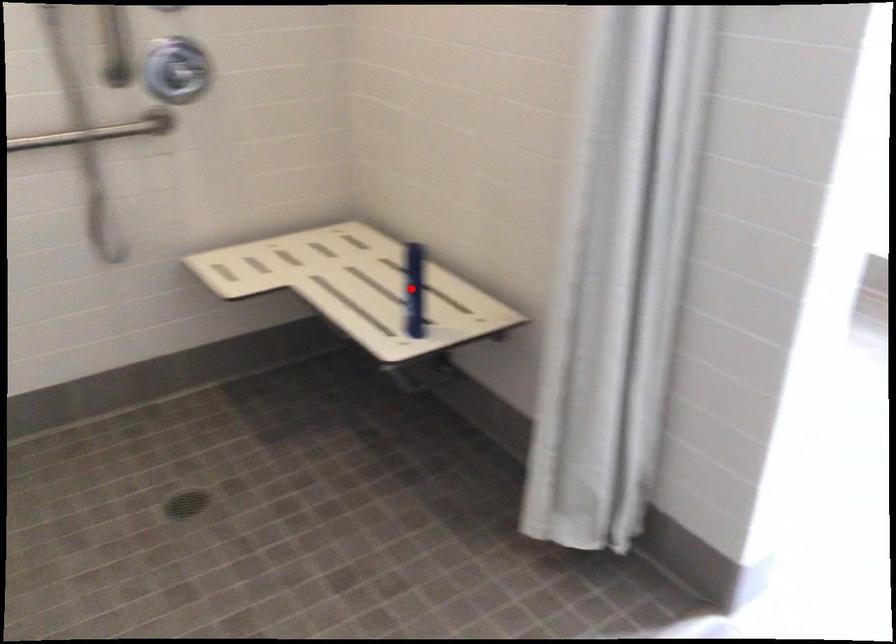
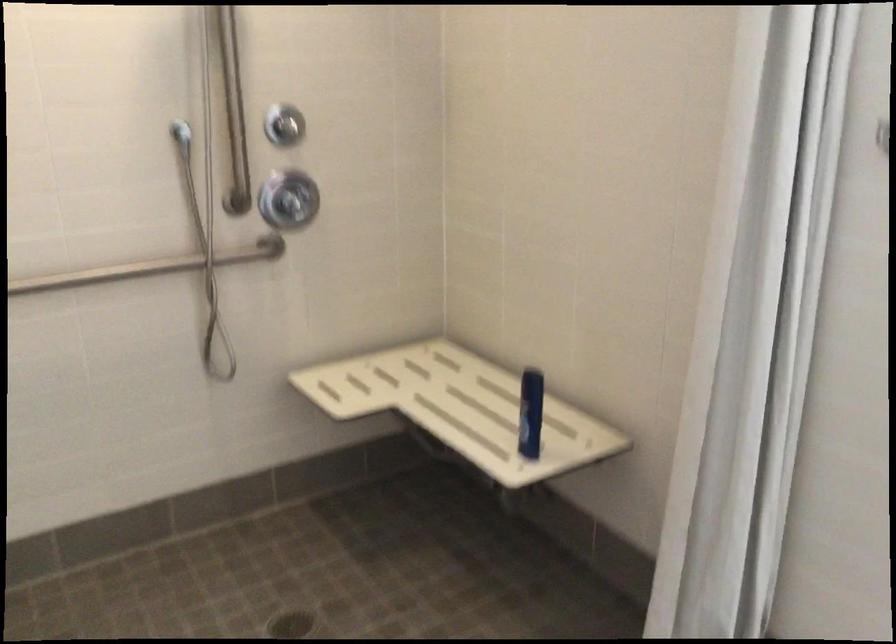
Where in the second image is the point corresponding to the highlighted location from the first image?

(530, 413)